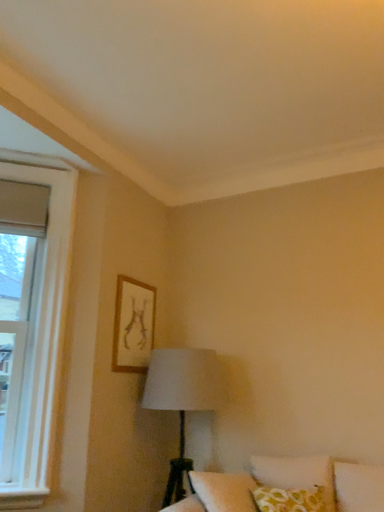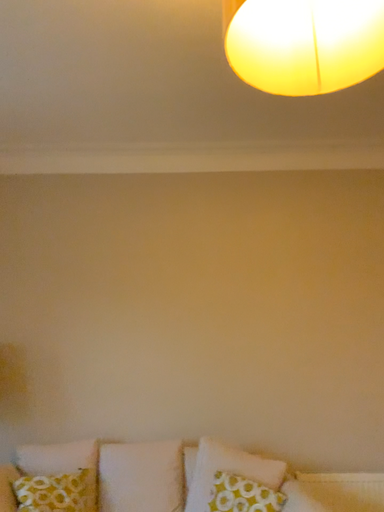
Question: Which way did the camera rotate in the video?

Choices:
 (A) rotated right
 (B) rotated left

Answer: (A)